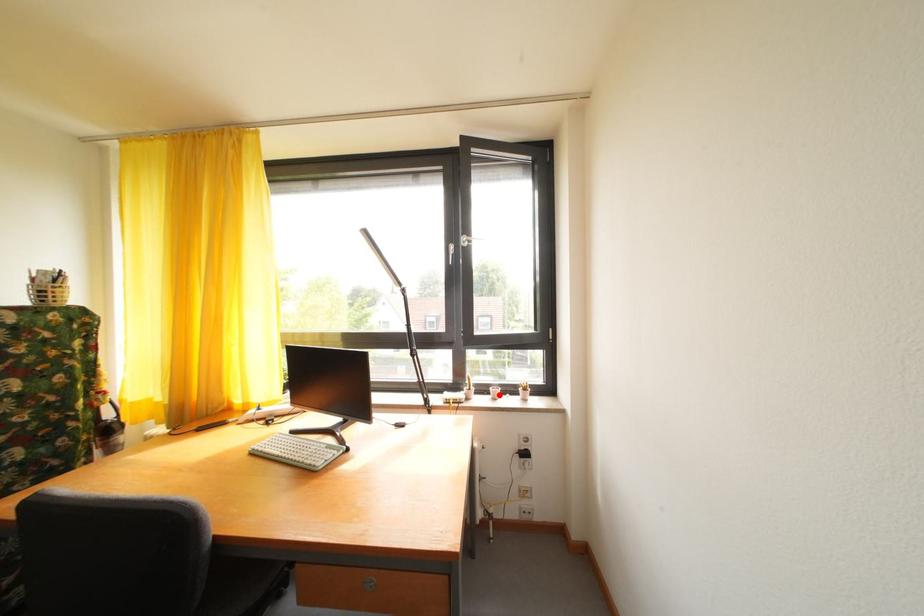
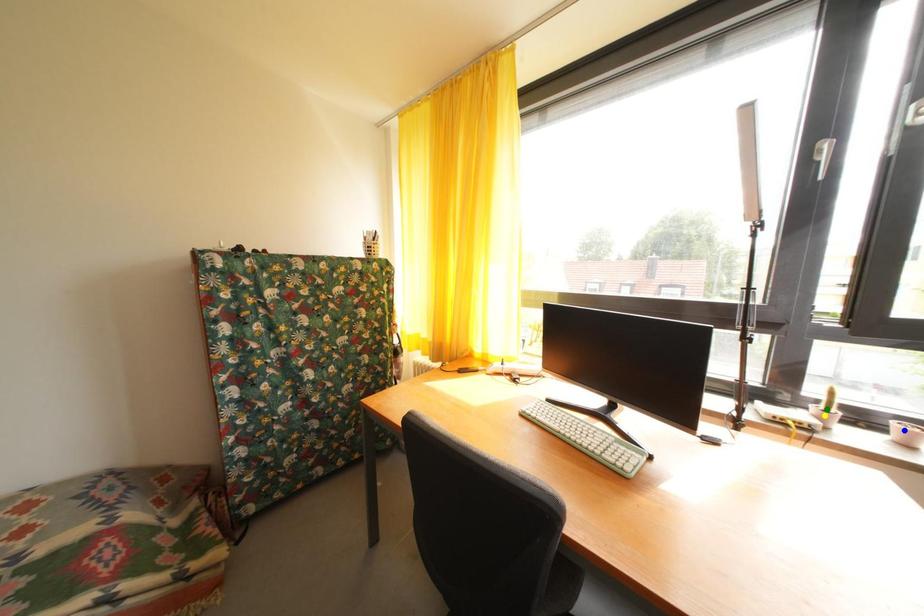
Question: I am providing you with two images of the same scene from different viewpoints. A red point is marked on the first image. You are given multiple points on the second image. Which mark in image 2 goes with the point in image 1?

Choices:
 (A) blue point
 (B) green point
 (C) yellow point

Answer: (A)